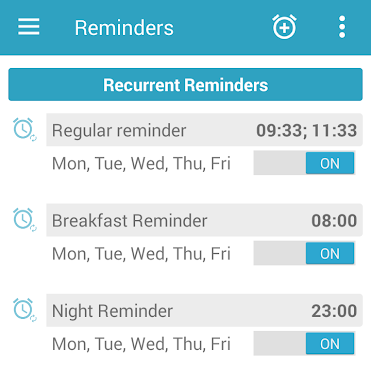
This screenshot has height=391, width=371. Identify the location of reminders banner. (200, 30).